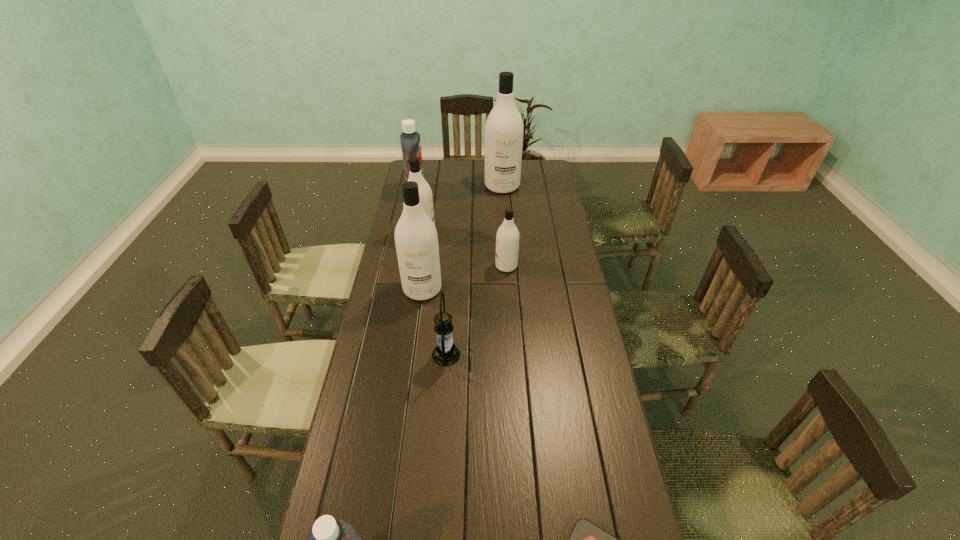
You are a GUI agent. You are given a task and a screenshot of the screen. Output one action in this format:
    pyautogui.click(x=<x>, y=<y>)
    Task: Click on the free space at the left edge of the desktop
    This screenshot has width=960, height=540.
    Given the screenshot: What is the action you would take?
    pyautogui.click(x=382, y=310)

What are the coordinates of `free region at the right edge of the desktop` in the screenshot? It's located at (565, 478).

The height and width of the screenshot is (540, 960). I want to click on free space at the far right corner of the desktop, so click(x=543, y=173).

At what (x,y) coordinates should I click in order to perform the action: click on vacant region between the tallest object and the bigger blue shampoo. Please return your answer as a coordinate pair (x, y). Image resolution: width=960 pixels, height=540 pixels. Looking at the image, I should click on (459, 190).

The width and height of the screenshot is (960, 540). In order to click on empty location between the farther blue shampoo and the farthest white shampoo in this screenshot , I will do `click(459, 190)`.

Identify the location of vacant region between the lantern and the smallest white shampoo. Image resolution: width=960 pixels, height=540 pixels. (476, 310).

Where is `empty space between the lantern and the third farthest white shampoo`? The image size is (960, 540). empty space between the lantern and the third farthest white shampoo is located at coordinates (476, 310).

The width and height of the screenshot is (960, 540). In order to click on the fifth closest object to the second tallest shampoo in this screenshot , I will do (504, 127).

Locate which object ranks fourth in proximity to the tallest shampoo. Please provide its 2D coordinates. Your answer should be formatted as a tuple, i.e. [(x, y)], where the tuple contains the x and y coordinates of a point satisfying the conditions above.

[(416, 240)]

The height and width of the screenshot is (540, 960). What are the coordinates of `shampoo that is the nearest to the biggest white shampoo` in the screenshot? It's located at (410, 140).